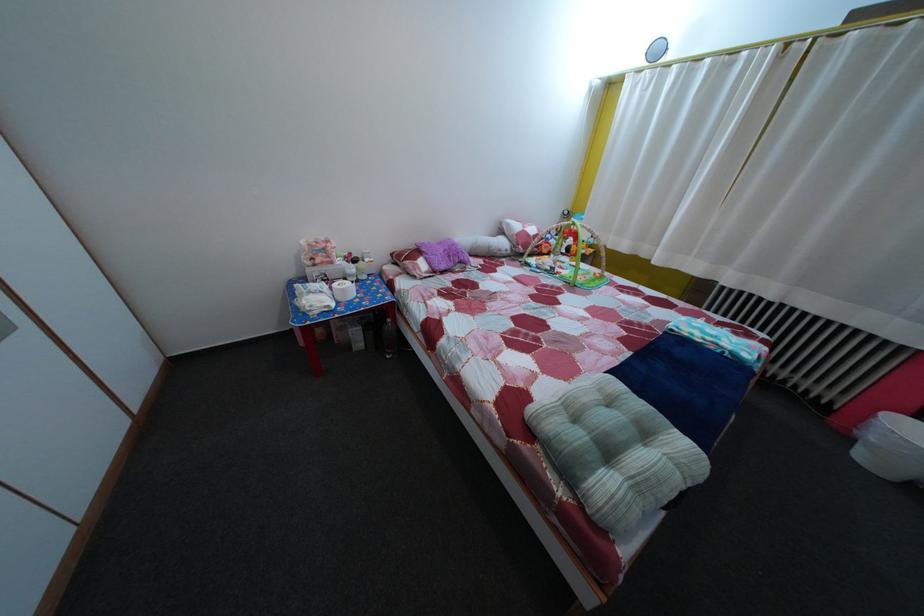
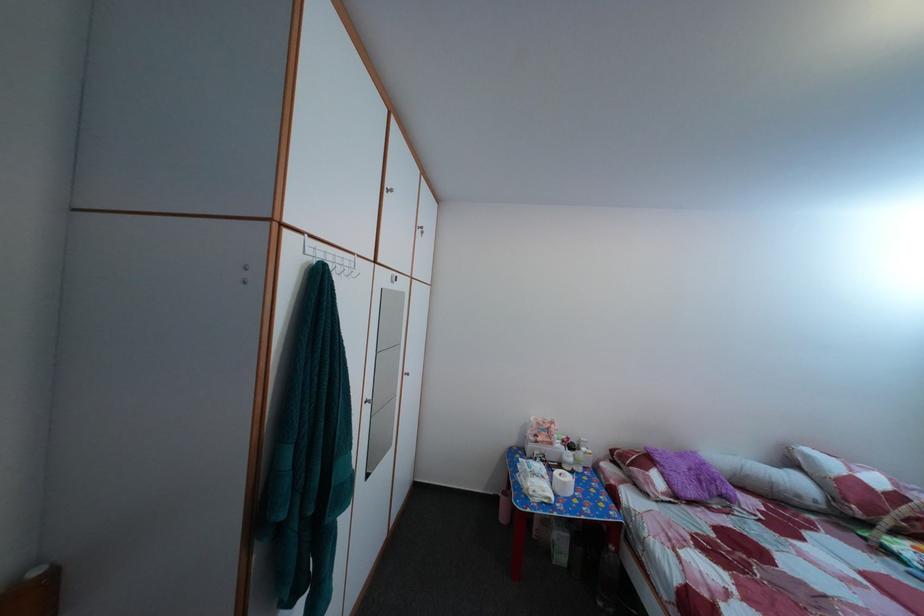
The point at (359, 262) is marked in the first image. Where is the corresponding point in the second image?

(578, 447)